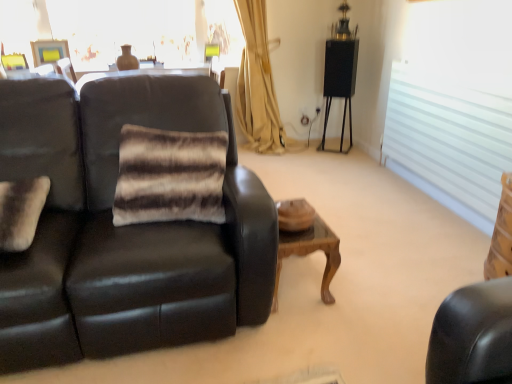
Question: Could you tell me if brown striped fur pillow at center, arranged as the first pillow when viewed from the right, is facing translucent glass window at upper center, which is counted as the second window, starting from the front?

Choices:
 (A) no
 (B) yes

Answer: (A)

Question: Is brown striped fur pillow at center, arranged as the first pillow when viewed from the right, to the left of translucent glass window at upper center, positioned as the 1th window in top-to-bottom order, from the viewer's perspective?

Choices:
 (A) no
 (B) yes

Answer: (A)

Question: From the image's perspective, is brown striped fur pillow at center, the 2th pillow from the left, under translucent glass window at upper center, positioned as the 1th window in left-to-right order?

Choices:
 (A) yes
 (B) no

Answer: (A)

Question: Is brown striped fur pillow at center, the 2th pillow from the left, not within translucent glass window at upper center, which is counted as the second window, starting from the front?

Choices:
 (A) yes
 (B) no

Answer: (A)

Question: Is brown striped fur pillow at center, arranged as the first pillow when viewed from the right, at the right side of translucent glass window at upper center, placed as the first window when sorted from back to front?

Choices:
 (A) no
 (B) yes

Answer: (B)

Question: Would you consider brown striped fur pillow at center, the 2th pillow from the left, to be distant from translucent glass window at upper center, positioned as the 1th window in left-to-right order?

Choices:
 (A) yes
 (B) no

Answer: (A)

Question: Are matte black couch at left and woodenwoodentable at center making contact?

Choices:
 (A) no
 (B) yes

Answer: (A)

Question: Considering the relative sizes of matte black couch at left and woodenwoodentable at center in the image provided, is matte black couch at left bigger than woodenwoodentable at center?

Choices:
 (A) yes
 (B) no

Answer: (A)

Question: Considering the relative sizes of matte black couch at left and woodenwoodentable at center in the image provided, is matte black couch at left thinner than woodenwoodentable at center?

Choices:
 (A) no
 (B) yes

Answer: (A)

Question: Is woodenwoodentable at center completely or partially inside matte black couch at left?

Choices:
 (A) no
 (B) yes

Answer: (A)

Question: From the image's perspective, is matte black couch at left below woodenwoodentable at center?

Choices:
 (A) yes
 (B) no

Answer: (B)

Question: From the image's perspective, is matte black couch at left on top of woodenwoodentable at center?

Choices:
 (A) yes
 (B) no

Answer: (A)

Question: Is brown striped fur pillow at center, the 2th pillow from the left, at the back of white frosted glass window at right, which ranks as the second window in left-to-right order?

Choices:
 (A) no
 (B) yes

Answer: (A)